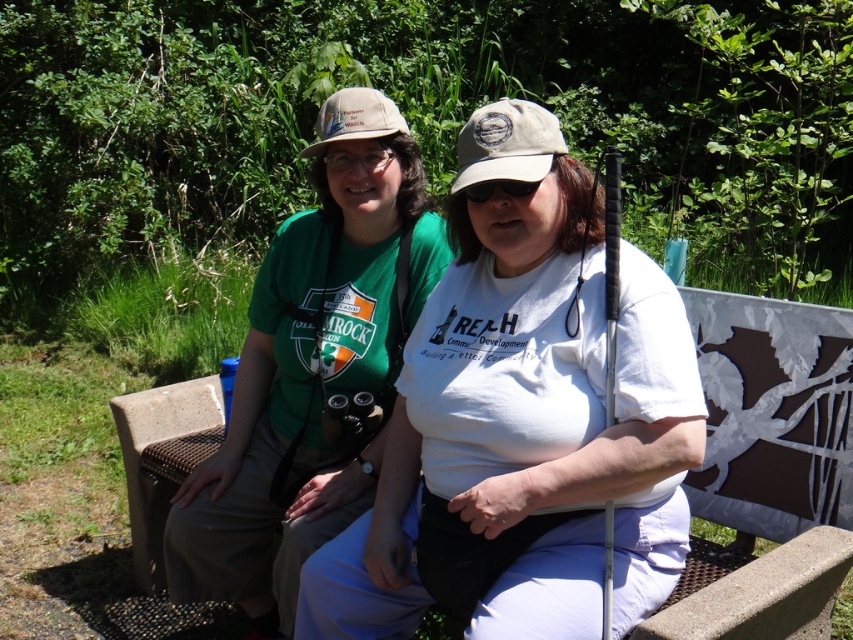
Based on the photo, you are a photographer trying to capture a candid shot of the two people on the bench. You want to ensure that both the white matte shirt at center and the khaki fabric baseball cap at center are clearly visible in the frame. Based on their positions, which object should you focus on first to ensure both are in focus?

The khaki fabric baseball cap at center should be focused on first because the white matte shirt at center is to the right of it, meaning the cap is closer to the left edge of the frame. By focusing on the cap first, you can adjust the camera to include both objects in the frame.